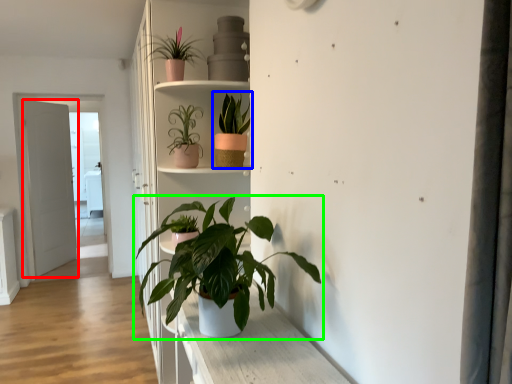
Question: Which object is the farthest from door (highlighted by a red box)? Choose among these: houseplant (highlighted by a blue box) or houseplant (highlighted by a green box).

Choices:
 (A) houseplant
 (B) houseplant

Answer: (B)